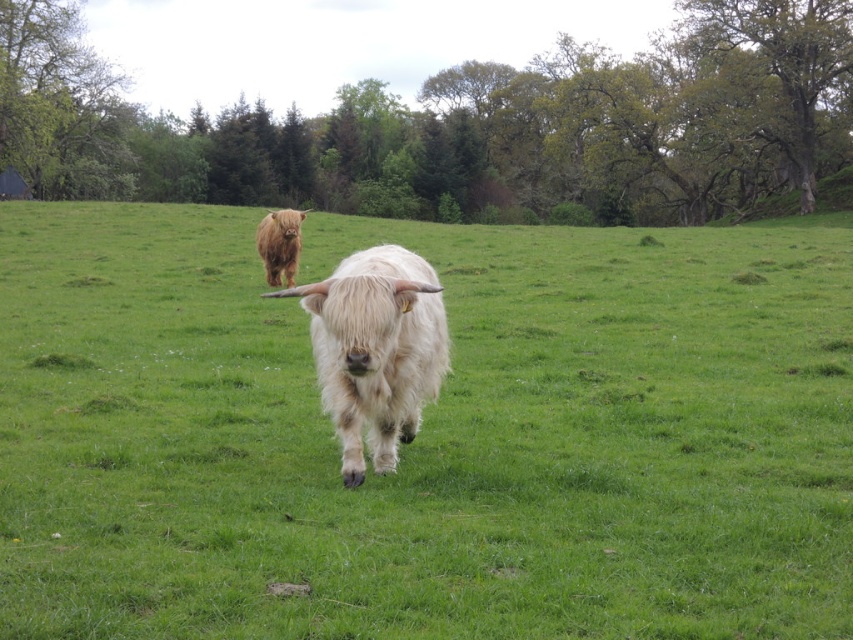
Question: Can you confirm if green grass at center is positioned below white woolly cow at center?

Choices:
 (A) no
 (B) yes

Answer: (A)

Question: Is green grass at center thinner than brown fuzzy cow at center?

Choices:
 (A) no
 (B) yes

Answer: (A)

Question: Which object is closer to the camera taking this photo?

Choices:
 (A) green grass at center
 (B) white woolly cow at center
 (C) brown fuzzy cow at center

Answer: (A)

Question: Based on their relative distances, which object is farther from the green grass at center?

Choices:
 (A) brown fuzzy cow at center
 (B) white woolly cow at center

Answer: (B)

Question: Which object appears farthest from the camera in this image?

Choices:
 (A) brown fuzzy cow at center
 (B) white woolly cow at center

Answer: (A)

Question: Is white woolly cow at center to the right of brown fuzzy cow at center from the viewer's perspective?

Choices:
 (A) yes
 (B) no

Answer: (A)